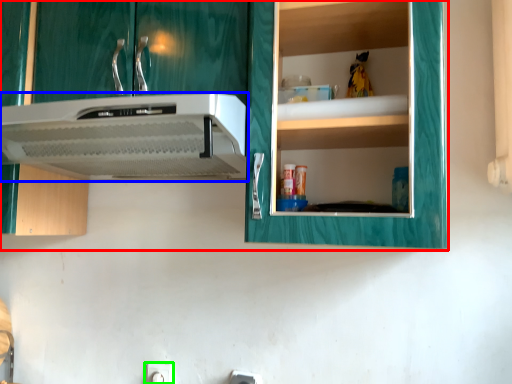
Question: Which is farther away from cabinetry (highlighted by a red box)? home appliance (highlighted by a blue box) or electric outlet (highlighted by a green box)?

Choices:
 (A) home appliance
 (B) electric outlet

Answer: (B)